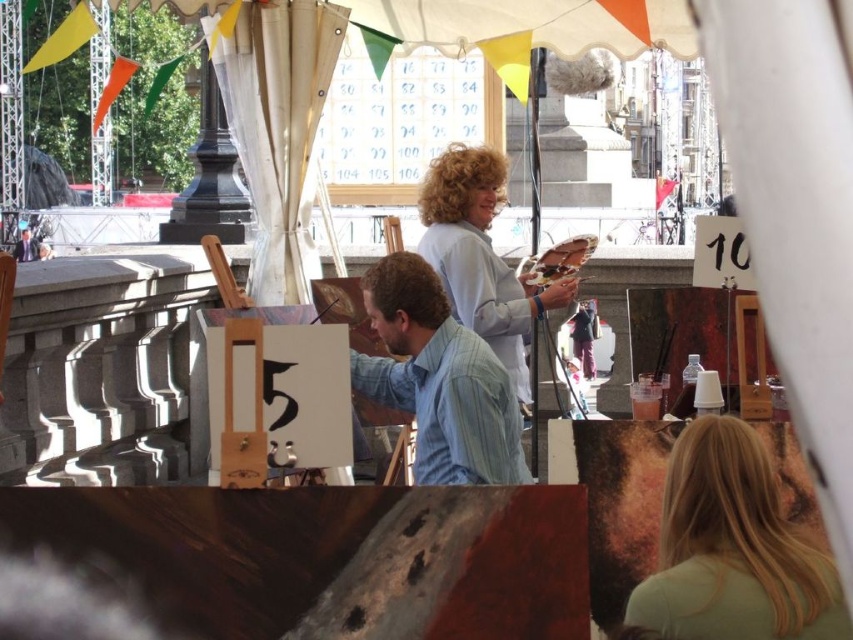
You are standing at the starting point of the art event and see two points marked as point [646,612] and point [457,284]. Which point is closer to you?

Point [646,612] is in front of point [457,284], so it is closer to you.

Looking at this image, you are an attendee at the art event and want to take a photo of both the light blue striped shirt at center and the light blue fabric at center. Since they are both light blue, you need to distinguish them in your photo. Which one should you focus on first to ensure both are in frame?

The light blue striped shirt at center is shorter than the light blue fabric at center, so you should focus on the light blue fabric at center first to ensure both are in frame.

You are an attendee at the art event and want to take a photo of the blonde hair at upper right and the light blue striped shirt at center without cropping either. Which object should you zoom in on to ensure both fit in the frame?

Since the blonde hair at upper right is narrower than the light blue striped shirt at center, you should zoom out slightly to include both the blonde hair at upper right and the light blue striped shirt at center in the frame.